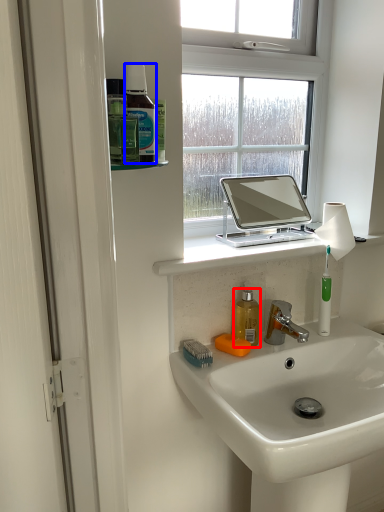
Question: Which point is closer to the camera, mouthwash (highlighted by a red box) or mouthwash (highlighted by a blue box)?

Choices:
 (A) mouthwash
 (B) mouthwash

Answer: (B)